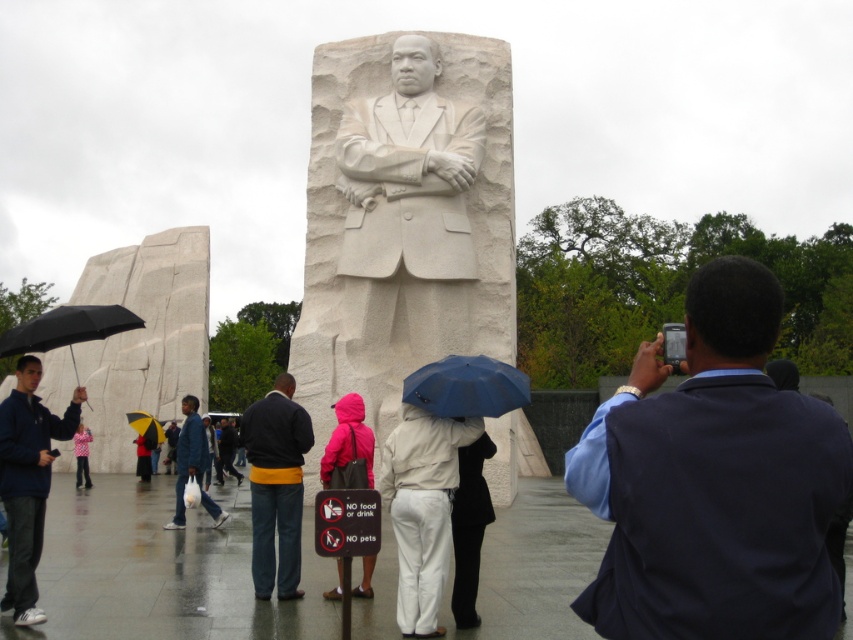
Find the location of `dark blue jacket at left`. dark blue jacket at left is located at coordinates (28, 481).

Who is more distant from viewer, [21,484] or [245,410]?

The point [245,410] is more distant.

The height and width of the screenshot is (640, 853). Identify the location of dark blue jacket at left. (28, 481).

Can you confirm if white marble statue at center is positioned below white matte pants at center?

No, white marble statue at center is not below white matte pants at center.

Does white marble statue at center have a larger size compared to white matte pants at center?

Correct, white marble statue at center is larger in size than white matte pants at center.

This screenshot has width=853, height=640. In order to click on white marble statue at center in this screenshot , I will do `click(404, 216)`.

Can you confirm if dark blue jacket with yellow stripe at center is bigger than black matte umbrella at left?

Actually, dark blue jacket with yellow stripe at center might be smaller than black matte umbrella at left.

Between dark blue jacket with yellow stripe at center and black matte umbrella at left, which one is positioned lower?

Positioned lower is dark blue jacket with yellow stripe at center.

This screenshot has width=853, height=640. I want to click on dark blue jacket with yellow stripe at center, so (x=276, y=484).